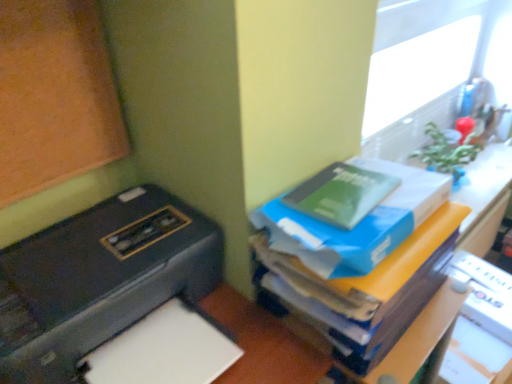
The image size is (512, 384). I want to click on vacant area that lies to the right of white paper at lower left, so tap(267, 341).